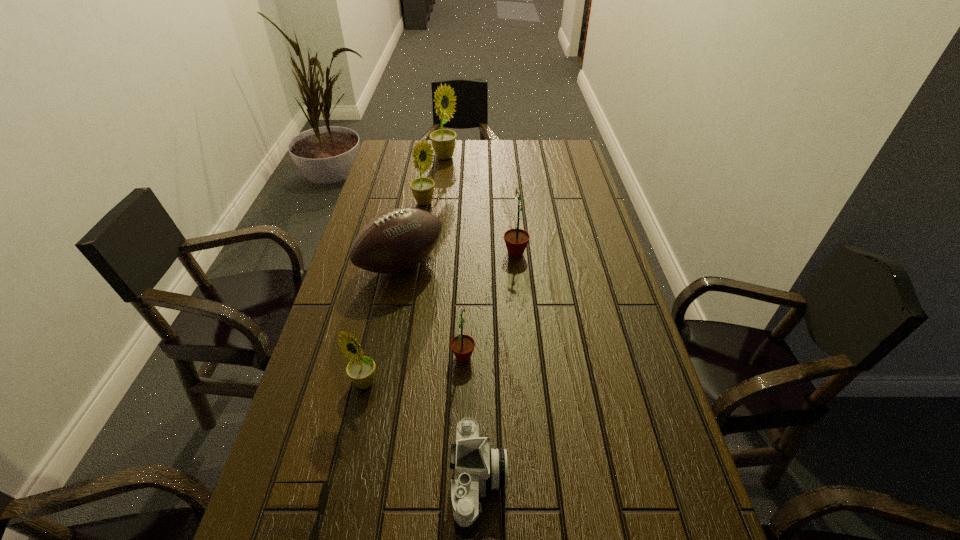
Identify the location of football (American) situated at the left edge. (395, 240).

In the image, there is a desktop. At what (x,y) coordinates should I click in order to perform the action: click on vacant space at the left edge. Please return your answer as a coordinate pair (x, y). The image size is (960, 540). Looking at the image, I should click on (409, 185).

Where is `vacant region at the right edge of the desktop`? This screenshot has height=540, width=960. vacant region at the right edge of the desktop is located at coordinates (681, 490).

I want to click on free space that is in between the football (American) and the rightmost sunflower, so click(x=459, y=259).

Find the location of `free spot between the bigger green sunflower and the nearer green sunflower`. free spot between the bigger green sunflower and the nearer green sunflower is located at coordinates (490, 305).

The height and width of the screenshot is (540, 960). Find the location of `vacant area that lies between the right green sunflower and the football (American)`. vacant area that lies between the right green sunflower and the football (American) is located at coordinates (459, 259).

Image resolution: width=960 pixels, height=540 pixels. Identify the location of vacant area between the farthest yellow sunflower and the second smallest yellow sunflower. (435, 180).

The image size is (960, 540). Find the location of `unoccupied area between the third nearest sunflower and the second smallest yellow sunflower`. unoccupied area between the third nearest sunflower and the second smallest yellow sunflower is located at coordinates (470, 228).

Identify which object is located as the seventh nearest to the camera. Please provide its 2D coordinates. Your answer should be formatted as a tuple, i.e. [(x, y)], where the tuple contains the x and y coordinates of a point satisfying the conditions above.

[(443, 141)]

Identify which object is the third closest to the sunglasses. Please provide its 2D coordinates. Your answer should be formatted as a tuple, i.e. [(x, y)], where the tuple contains the x and y coordinates of a point satisfying the conditions above.

[(462, 346)]